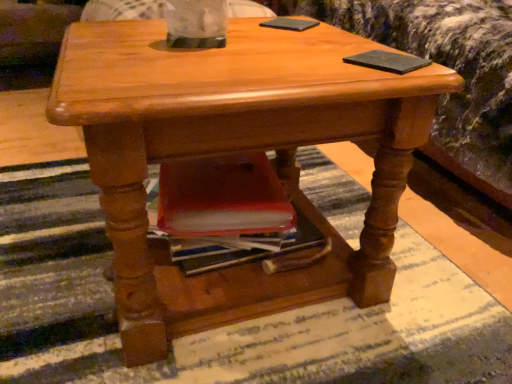
Locate an element on the screen. The width and height of the screenshot is (512, 384). vacant space that is to the left of green matte pad at upper center, which ranks as the 1th pad in top-to-bottom order is located at coordinates (236, 23).